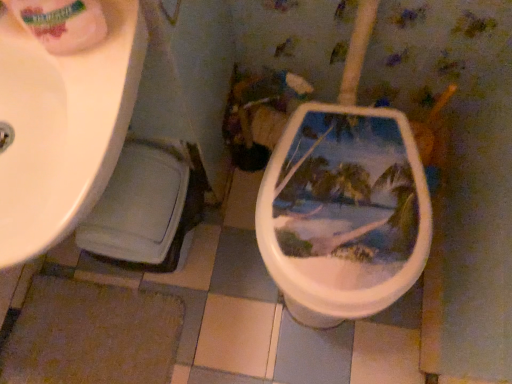
Describe the element at coordinates (62, 127) in the screenshot. This screenshot has height=384, width=512. I see `white glossy sink at upper left` at that location.

In order to face white glossy sink at upper left, should I rotate leftwards or rightwards?

You should look left and rotate roughly 28.865 degrees.

At what (x,y) coordinates should I click in order to perform the action: click on white glossy sink at upper left. Please return your answer as a coordinate pair (x, y). This screenshot has height=384, width=512. Looking at the image, I should click on (62, 127).

Image resolution: width=512 pixels, height=384 pixels. What do you see at coordinates (62, 23) in the screenshot?
I see `white glossy toilet paper at upper left` at bounding box center [62, 23].

Find the location of `white glossy toilet paper at upper left`. white glossy toilet paper at upper left is located at coordinates (62, 23).

The height and width of the screenshot is (384, 512). In order to click on white glossy sink at upper left in this screenshot , I will do coord(62,127).

Is white glossy sink at upper left at the left side of white glossy toilet paper at upper left?

Indeed, white glossy sink at upper left is positioned on the left side of white glossy toilet paper at upper left.

Which object is further away from the camera taking this photo, white glossy sink at upper left or white glossy toilet paper at upper left?

white glossy sink at upper left is more distant.

Considering the points (6, 27) and (79, 28), which point is in front, point (6, 27) or point (79, 28)?

The point (79, 28) is more forward.

From the image's perspective, is white glossy sink at upper left located beneath white glossy toilet paper at upper left?

Correct, white glossy sink at upper left appears lower than white glossy toilet paper at upper left in the image.

From a real-world perspective, between white glossy sink at upper left and white glossy toilet paper at upper left, who is vertically lower?

white glossy sink at upper left.

Considering the relative sizes of white glossy sink at upper left and white glossy toilet paper at upper left in the image provided, is white glossy sink at upper left thinner than white glossy toilet paper at upper left?

In fact, white glossy sink at upper left might be wider than white glossy toilet paper at upper left.

Between white glossy sink at upper left and white glossy toilet paper at upper left, which one has more height?

white glossy sink at upper left is taller.

Is white glossy sink at upper left bigger than white glossy toilet paper at upper left?

Correct, white glossy sink at upper left is larger in size than white glossy toilet paper at upper left.

Would you say white glossy sink at upper left contains white glossy toilet paper at upper left?

Definitely not — white glossy toilet paper at upper left is not inside white glossy sink at upper left.

Is white glossy sink at upper left with white glossy toilet paper at upper left?

No, white glossy sink at upper left is not beside white glossy toilet paper at upper left.

Is white glossy sink at upper left aimed at white glossy toilet paper at upper left?

No, white glossy sink at upper left is not turned towards white glossy toilet paper at upper left.

How different are the orientations of white glossy sink at upper left and white glossy toilet paper at upper left in degrees?

They differ by 25 degrees in their facing directions.

The height and width of the screenshot is (384, 512). I want to click on toilet paper that appears on the right of white glossy sink at upper left, so click(x=62, y=23).

Does white glossy toilet paper at upper left appear on the right side of white glossy sink at upper left?

Yes, white glossy toilet paper at upper left is to the right of white glossy sink at upper left.

Is white glossy toilet paper at upper left in front of or behind white glossy sink at upper left in the image?

Visually, white glossy toilet paper at upper left is located in front of white glossy sink at upper left.

Is point (47, 26) in front of point (141, 48)?

Yes, it is in front of point (141, 48).

From the image's perspective, would you say white glossy toilet paper at upper left is positioned over white glossy sink at upper left?

Yes, from the image's perspective, white glossy toilet paper at upper left is above white glossy sink at upper left.

From a real-world perspective, relative to white glossy sink at upper left, is white glossy toilet paper at upper left vertically above or below?

From a real-world perspective, white glossy toilet paper at upper left is physically above white glossy sink at upper left.

Which of these two, white glossy toilet paper at upper left or white glossy sink at upper left, is wider?

white glossy sink at upper left.

Considering the sizes of white glossy toilet paper at upper left and white glossy sink at upper left in the image, is white glossy toilet paper at upper left taller or shorter than white glossy sink at upper left?

white glossy toilet paper at upper left is shorter than white glossy sink at upper left.

Which of these two, white glossy toilet paper at upper left or white glossy sink at upper left, is smaller?

white glossy toilet paper at upper left is smaller.

Is white glossy toilet paper at upper left spatially inside white glossy sink at upper left, or outside of it?

white glossy toilet paper at upper left is not enclosed by white glossy sink at upper left.

Are white glossy toilet paper at upper left and white glossy sink at upper left beside each other?

white glossy toilet paper at upper left and white glossy sink at upper left are clearly separated.

Could you tell me if white glossy toilet paper at upper left is facing white glossy sink at upper left?

No, white glossy toilet paper at upper left is not oriented towards white glossy sink at upper left.

Can you tell me how much white glossy toilet paper at upper left and white glossy sink at upper left differ in facing direction?

The angle between the facing direction of white glossy toilet paper at upper left and the facing direction of white glossy sink at upper left is 25 degrees.

Locate an element on the screen. toilet paper that is above the white glossy sink at upper left (from a real-world perspective) is located at coordinates (62, 23).

Locate an element on the screen. sink below the white glossy toilet paper at upper left (from a real-world perspective) is located at coordinates (62, 127).

Locate an element on the screen. sink behind the white glossy toilet paper at upper left is located at coordinates (62, 127).